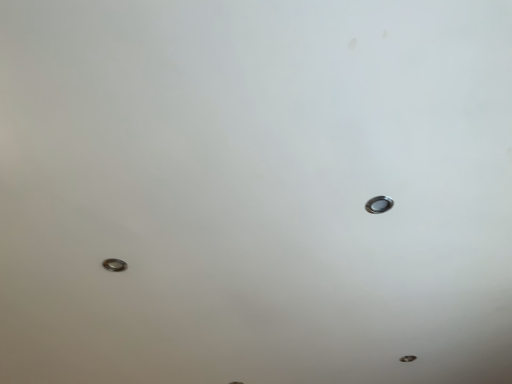
Question: Does point (373, 201) appear closer or farther from the camera than point (122, 266)?

Choices:
 (A) closer
 (B) farther

Answer: (A)

Question: From a real-world perspective, is silver metallic nail at upper right positioned above or below silver metallic bolt at lower left?

Choices:
 (A) above
 (B) below

Answer: (A)

Question: Considering their positions, is silver metallic nail at upper right located in front of or behind silver metallic bolt at lower left?

Choices:
 (A) behind
 (B) front

Answer: (B)

Question: From the image's perspective, relative to silver metallic nail at upper right, is silver metallic bolt at lower left above or below?

Choices:
 (A) above
 (B) below

Answer: (B)

Question: Relative to silver metallic nail at upper right, is silver metallic bolt at lower left in front or behind?

Choices:
 (A) front
 (B) behind

Answer: (B)

Question: From their relative heights in the image, would you say silver metallic bolt at lower left is taller or shorter than silver metallic nail at upper right?

Choices:
 (A) short
 (B) tall

Answer: (B)

Question: In terms of width, does silver metallic bolt at lower left look wider or thinner when compared to silver metallic nail at upper right?

Choices:
 (A) wide
 (B) thin

Answer: (A)